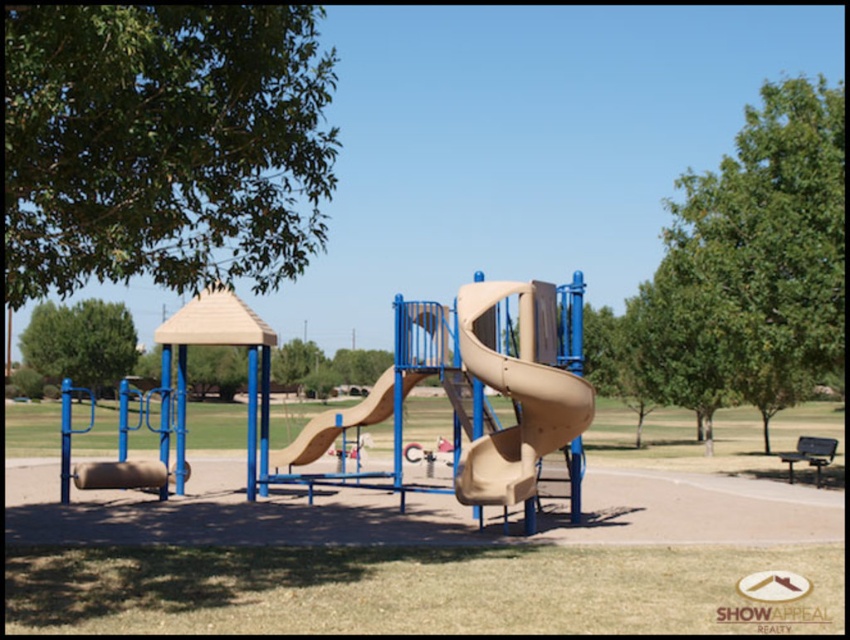
Question: Is green leafy tree at upper left to the right of green leafy tree at left from the viewer's perspective?

Choices:
 (A) no
 (B) yes

Answer: (B)

Question: Is green leafy tree at upper left positioned in front of beige rubber slide at center?

Choices:
 (A) no
 (B) yes

Answer: (B)

Question: Estimate the real-world distances between objects in this image. Which object is closer to the green leafy tree at left?

Choices:
 (A) green leafy tree at upper left
 (B) beige matte slide at center

Answer: (A)

Question: Among these points, which one is farthest from the camera?

Choices:
 (A) (129, 342)
 (B) (822, 204)

Answer: (A)

Question: Which point appears closest to the camera in this image?

Choices:
 (A) (732, 340)
 (B) (37, 342)

Answer: (A)

Question: Does beige matte slide at center appear on the right side of beige rubber slide at center?

Choices:
 (A) yes
 (B) no

Answer: (A)